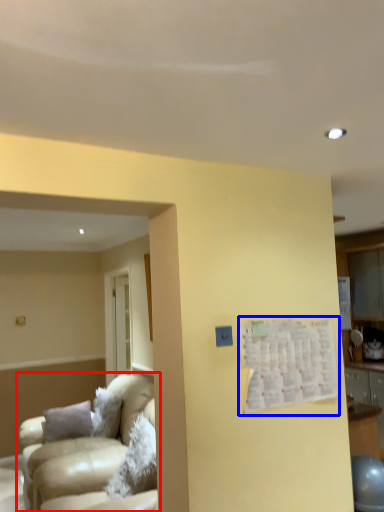
Question: Which object appears farthest to the camera in this image, studio couch (highlighted by a red box) or bulletin board (highlighted by a blue box)?

Choices:
 (A) studio couch
 (B) bulletin board

Answer: (A)